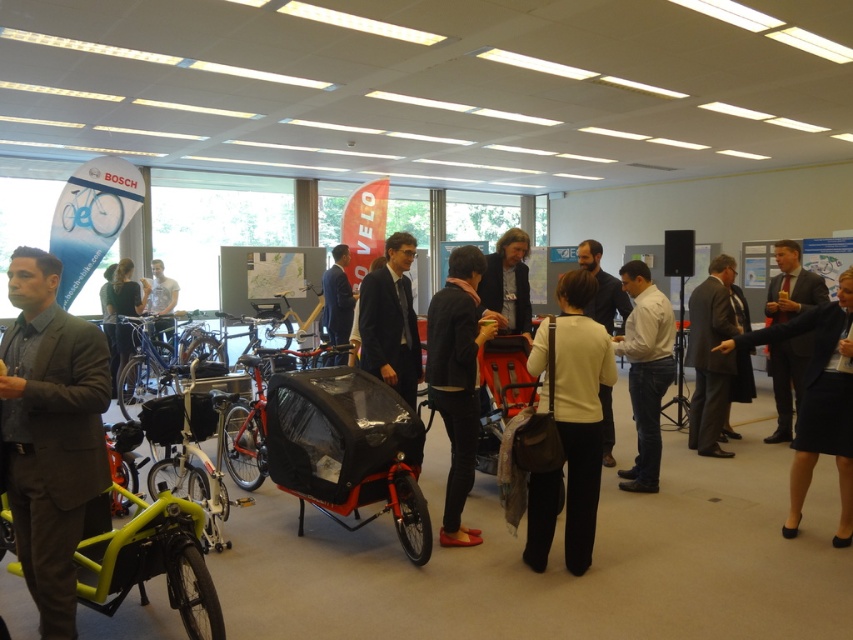
In the scene shown: Who is lower down, matte black suit at center or matte black cargo bike at center?

matte black cargo bike at center is lower down.

Between matte black suit at center and matte black cargo bike at center, which one appears on the left side from the viewer's perspective?

Positioned to the left is matte black cargo bike at center.

What do you see at coordinates (390, 321) in the screenshot?
I see `matte black suit at center` at bounding box center [390, 321].

You are a GUI agent. You are given a task and a screenshot of the screen. Output one action in this format:
    pyautogui.click(x=<x>, y=<y>)
    Task: Click on the matte black suit at center
    
    Given the screenshot: What is the action you would take?
    pyautogui.click(x=390, y=321)

Does point (527, 272) lie behind point (155, 310)?

No, it is in front of (155, 310).

Does matte black jacket at center have a greater height compared to light blue shirt at center?

Incorrect, matte black jacket at center's height is not larger of light blue shirt at center's.

Which is behind, point (525, 268) or point (155, 266)?

The point (155, 266) is more distant.

Where is `matte black jacket at center`? The image size is (853, 640). matte black jacket at center is located at coordinates (508, 282).

What do you see at coordinates (254, 417) in the screenshot? The width and height of the screenshot is (853, 640). I see `matte black cargo bike at center` at bounding box center [254, 417].

This screenshot has height=640, width=853. I want to click on matte black cargo bike at center, so click(254, 417).

Find the location of a particular element. Image resolution: width=853 pixels, height=640 pixels. matte black cargo bike at center is located at coordinates (254, 417).